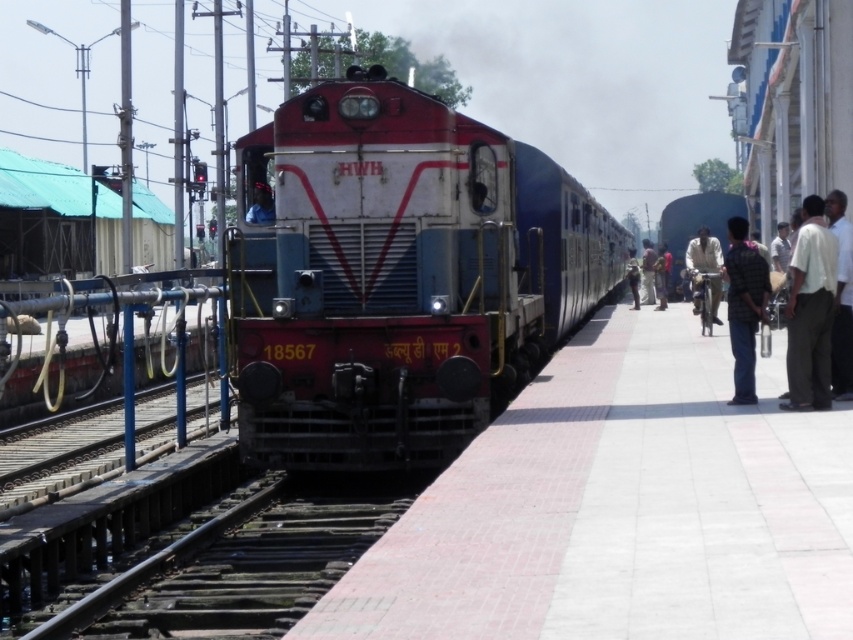
You are a photographer standing on the platform at the railway station. You want to take a photo of the matte red locomotive at center and the white matte shirt at center such that both are clearly visible. Considering their sizes, which object should you focus on to ensure both are in frame?

The matte red locomotive at center is larger in size than the white matte shirt at center. To ensure both are in frame, focus on the matte red locomotive at center since it is larger and will occupy more of the photo, allowing the smaller white matte shirt at center to also be visible.

You are a photographer positioned on the platform at the railway station. You want to take a photo of the plaid shirt at right and the white shirt at right such that both are fully visible in the frame. Given that your camera has a fixed width of 1 meter, can you fit both individuals into the photo without cropping either of them?

The plaid shirt at right might be wider than white shirt at right, so there is uncertainty about whether both can fit within the camera frame. If the plaid shirt at right is indeed wider, the total width required could exceed 1 meter, making it difficult to capture both fully. However, if they are similar in width, it might be possible. Without exact measurements, it is uncertain.